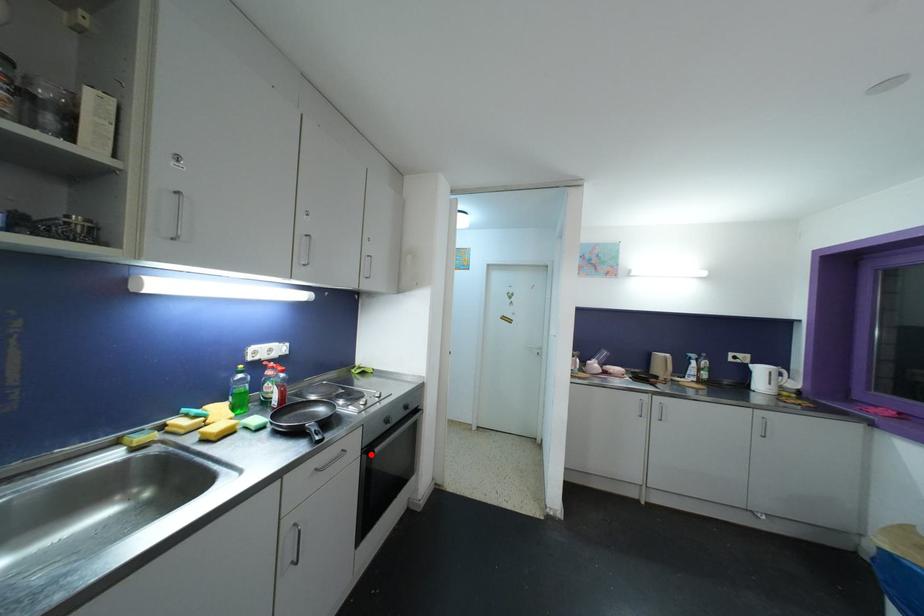
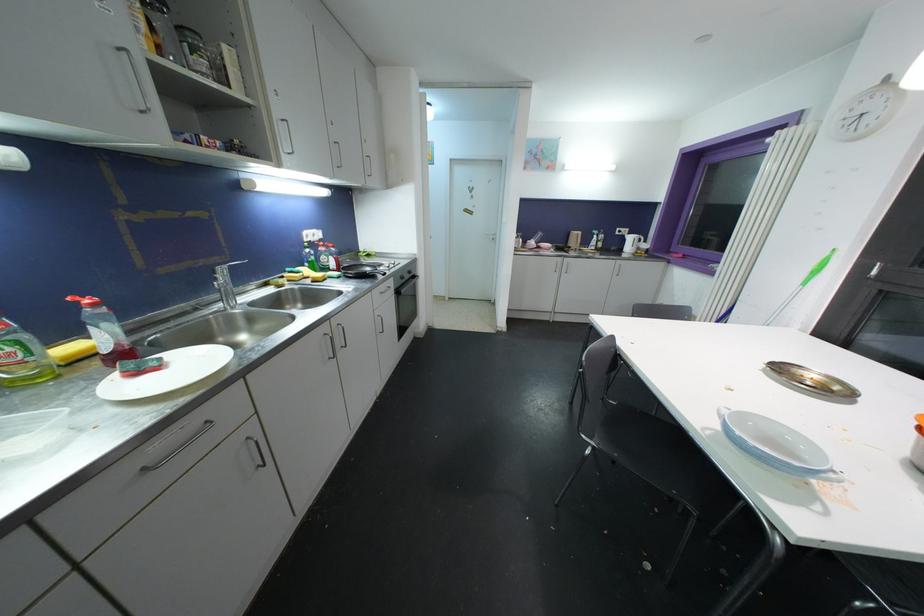
Locate, in the second image, the point that corresponds to the highlighted location in the first image.

(400, 294)